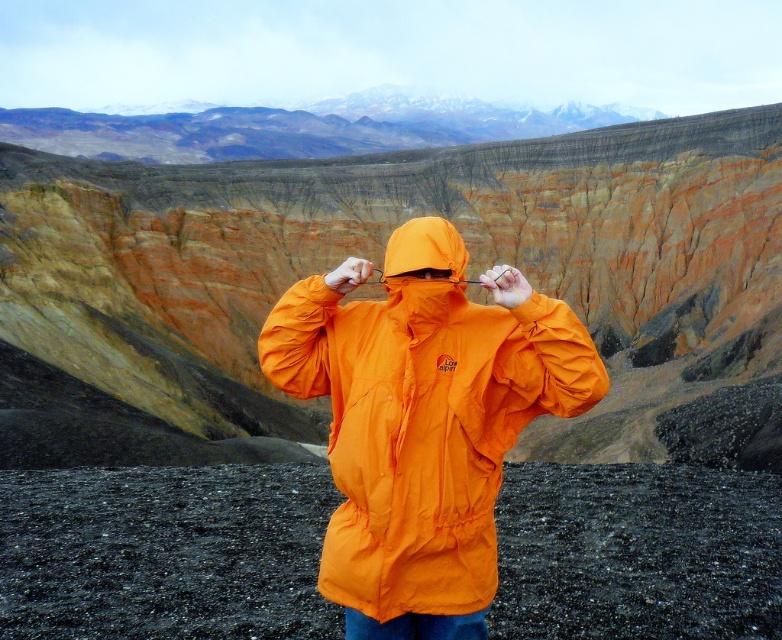
You are a hiker planning to set up a tent between the orange fabric mountain at center and the orange waterproof jacket at center. Given that your tent requires 10 meters of space, will there be enough room?

The orange fabric mountain at center and orange waterproof jacket at center are 101.49 meters apart from each other, so yes, there is more than enough space to set up a tent requiring 10 meters between them.

You are planning to take a photo of the orange fabric mountain at center and the orange waterproof jacket at center. Which object should you focus on first if you want to capture both in the same frame without moving the camera?

The orange fabric mountain at center is wider than the orange waterproof jacket at center, so you should focus on the orange waterproof jacket at center first to ensure both fit in the frame.